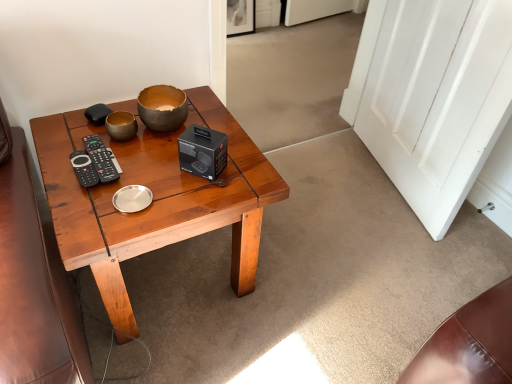
Where is `vacant area that is situated to the right of wooden coffee table at center`? Image resolution: width=512 pixels, height=384 pixels. vacant area that is situated to the right of wooden coffee table at center is located at coordinates (315, 277).